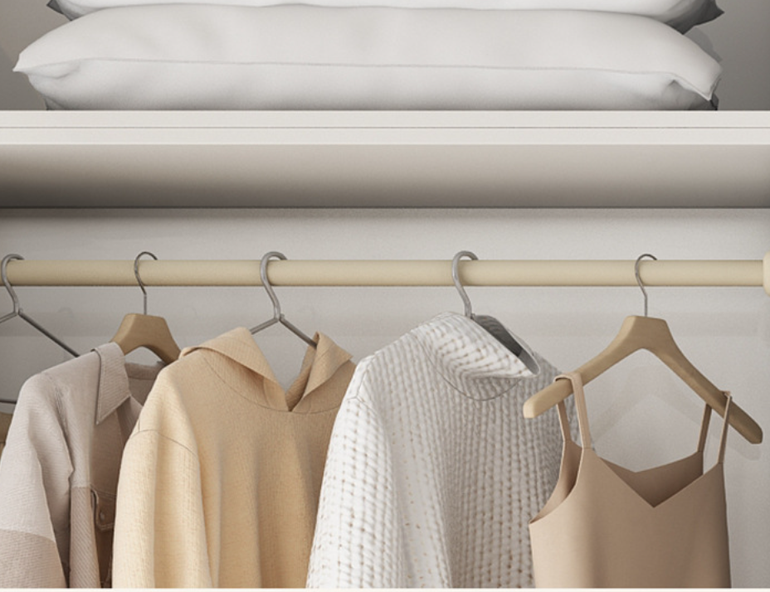
The image size is (770, 592). In order to click on clothes hangers in this screenshot , I will do `click(15, 310)`, `click(136, 320)`, `click(280, 313)`, `click(467, 308)`, `click(651, 324)`.